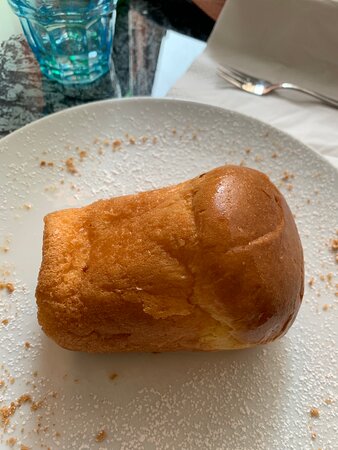
The image size is (338, 450). Find the location of `plate`. plate is located at coordinates (33, 233).